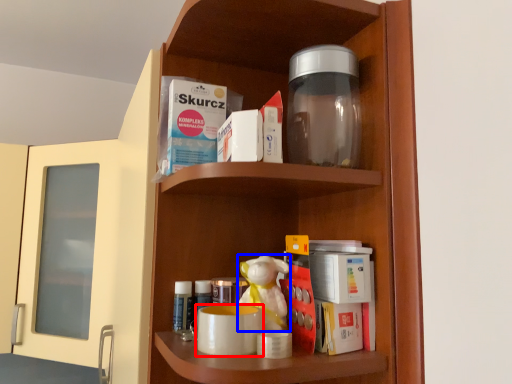
Question: Which object is closer to the camera taking this photo, mug (highlighted by a red box) or toy (highlighted by a blue box)?

Choices:
 (A) mug
 (B) toy

Answer: (A)